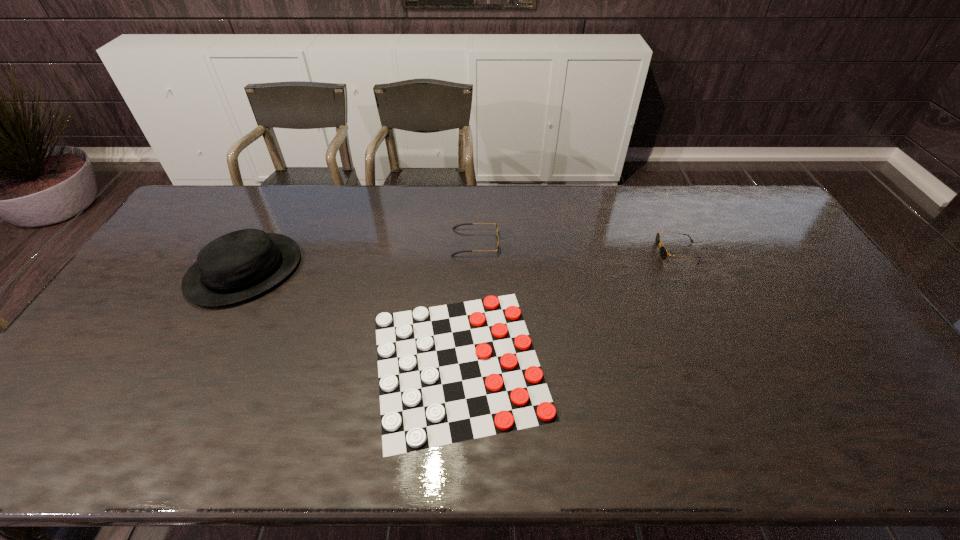
Locate an element on the screen. The width and height of the screenshot is (960, 540). vacant space that satisfies the following two spatial constraints: 1. on the front-facing side of the left sunglasses; 2. on the front side of the checkerboard is located at coordinates (473, 363).